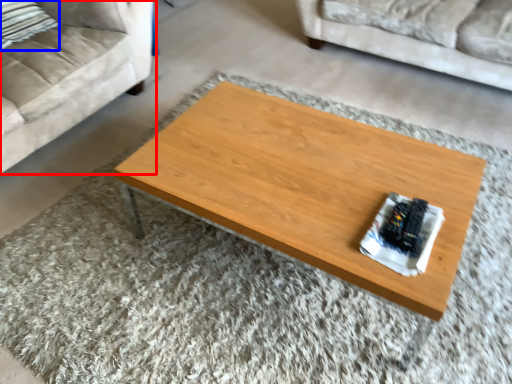
Question: Which point is further to the camera, studio couch (highlighted by a red box) or pillow (highlighted by a blue box)?

Choices:
 (A) studio couch
 (B) pillow

Answer: (B)